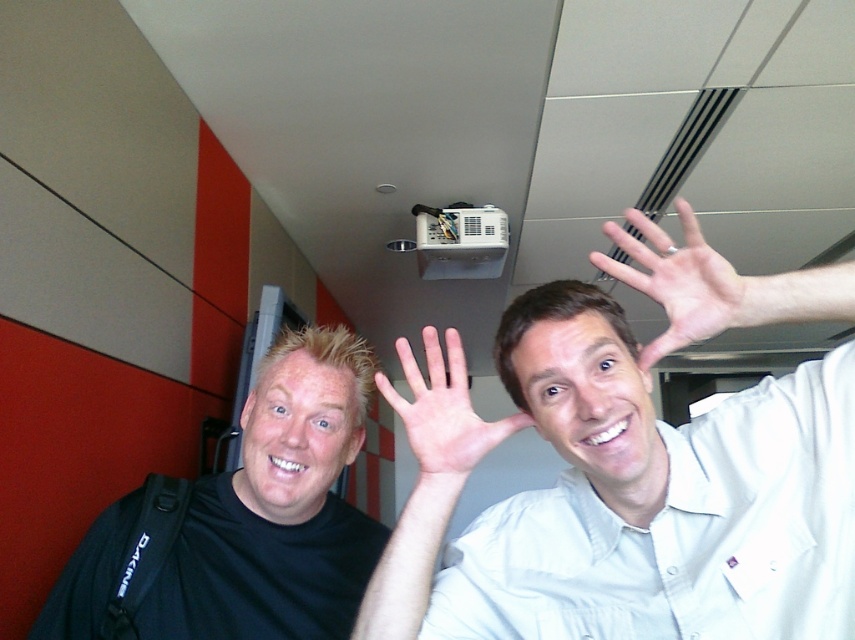
Looking at this image, measure the distance from white matte hand at upper right to pale skin palm at center.

They are 10.22 inches apart.

Is white matte hand at upper right taller than pale skin palm at center?

Indeed, white matte hand at upper right has a greater height compared to pale skin palm at center.

Is point (606, 224) closer to viewer compared to point (420, 454)?

Yes, it is.

Find the location of a particular element. This screenshot has height=640, width=855. white matte hand at upper right is located at coordinates (684, 282).

Who is taller, black matte shirt at left or pale skin palm at center?

black matte shirt at left is taller.

Can you confirm if black matte shirt at left is shorter than pale skin palm at center?

No, black matte shirt at left is not shorter than pale skin palm at center.

Locate an element on the screen. This screenshot has height=640, width=855. black matte shirt at left is located at coordinates (276, 509).

Does point (293, 518) come closer to viewer compared to point (628, 234)?

No, it is behind (628, 234).

Is black matte shirt at left to the right of white matte hand at upper right from the viewer's perspective?

No, black matte shirt at left is not to the right of white matte hand at upper right.

Is point (280, 444) behind point (694, 301)?

That is True.

The image size is (855, 640). Identify the location of black matte shirt at left. (276, 509).